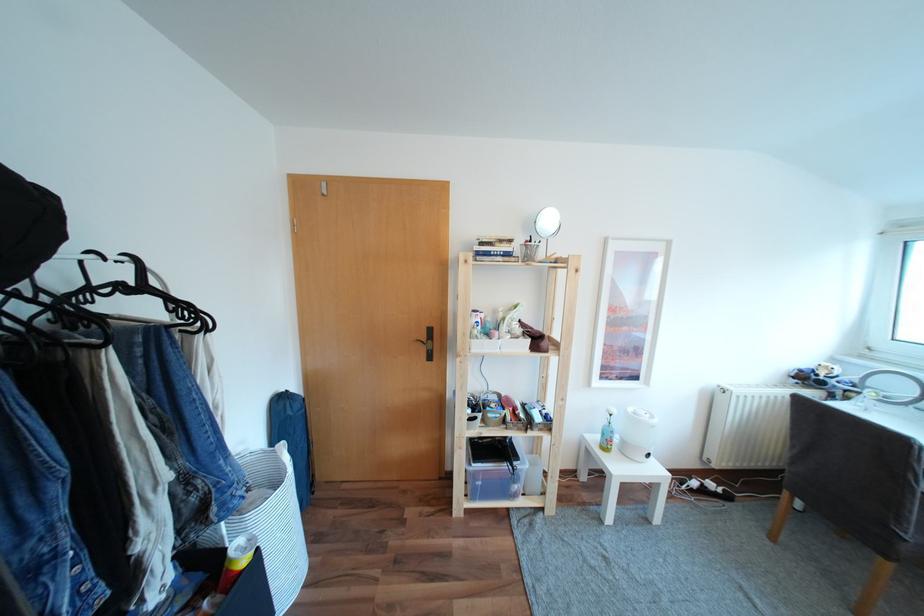
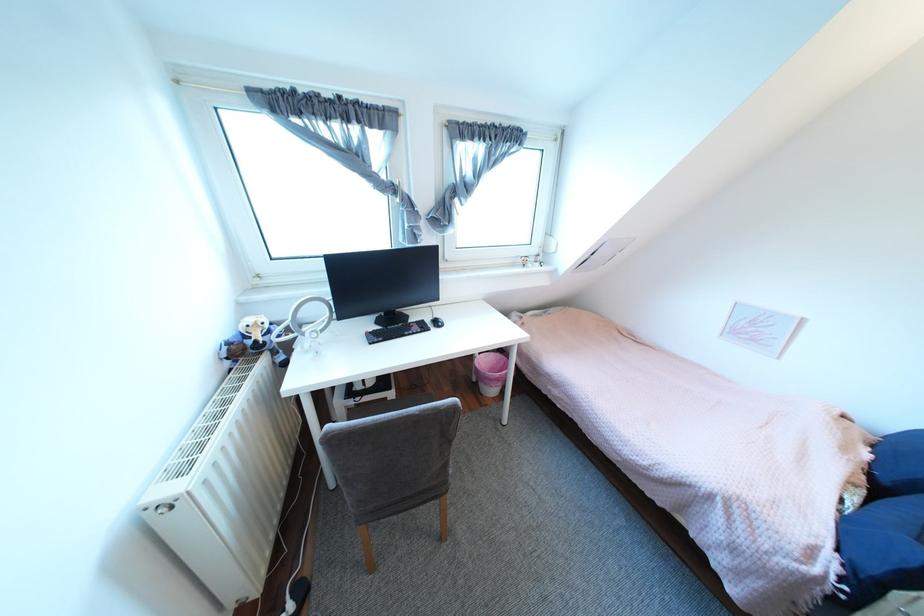
In the second image, find the point that corresponds to the point at 810,371 in the first image.

(239, 342)